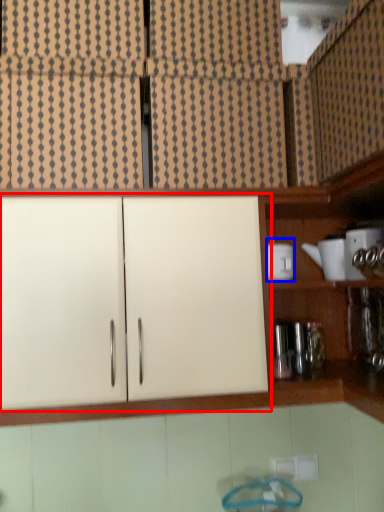
Question: Among these objects, which one is nearest to the camera, cabinetry (highlighted by a red box) or appliance (highlighted by a blue box)?

Choices:
 (A) cabinetry
 (B) appliance

Answer: (A)